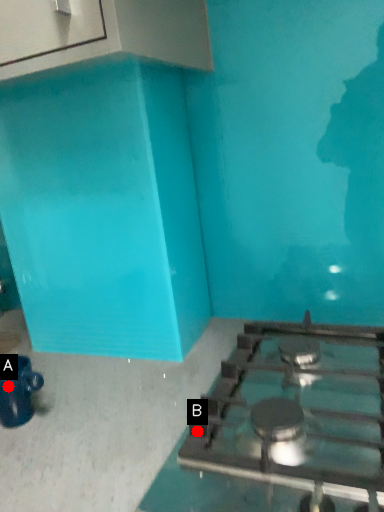
Question: Two points are circled on the image, labeled by A and B beside each circle. Which of the following is the closest to the observer?

Choices:
 (A) A is closer
 (B) B is closer

Answer: (B)